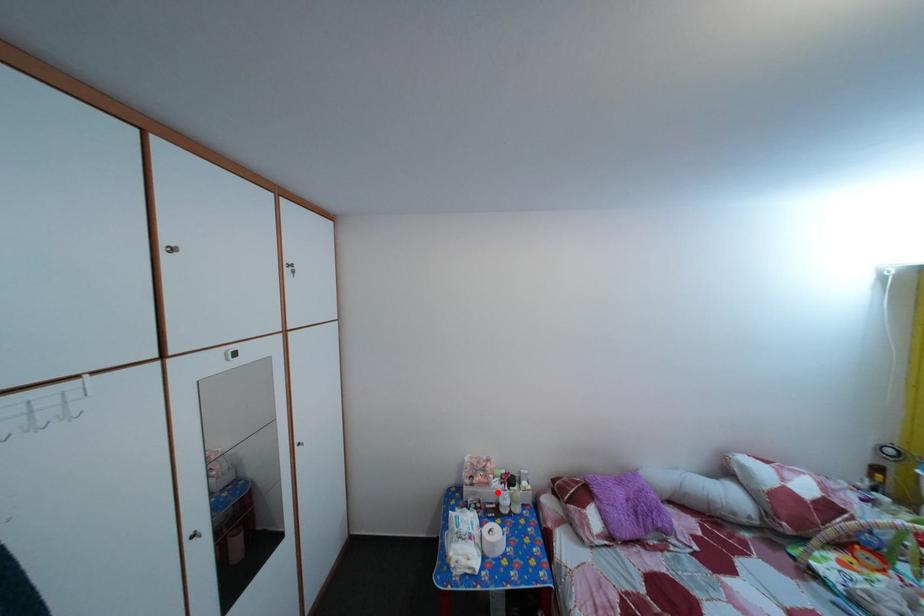
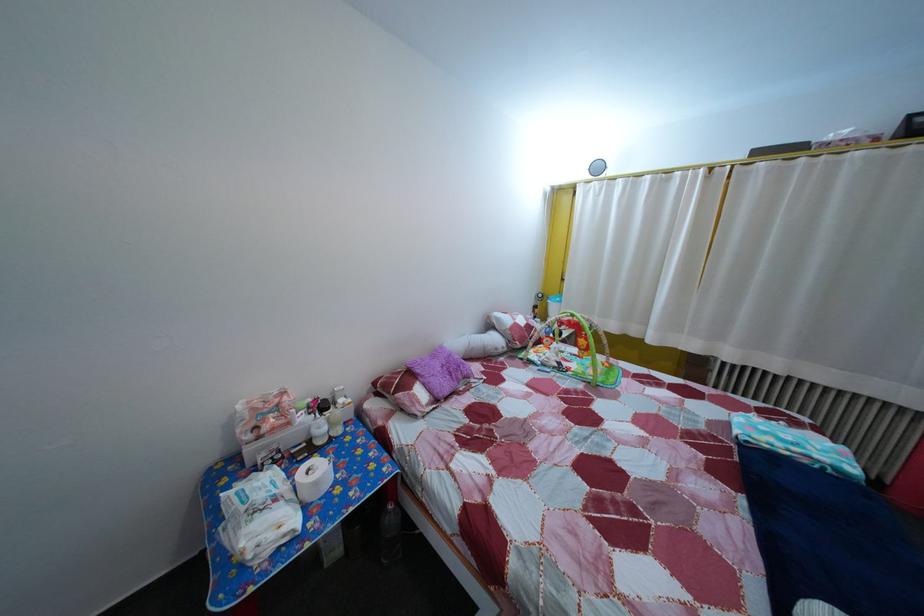
Where in the second image is the point corresponding to the highlighted location from the first image?

(298, 432)